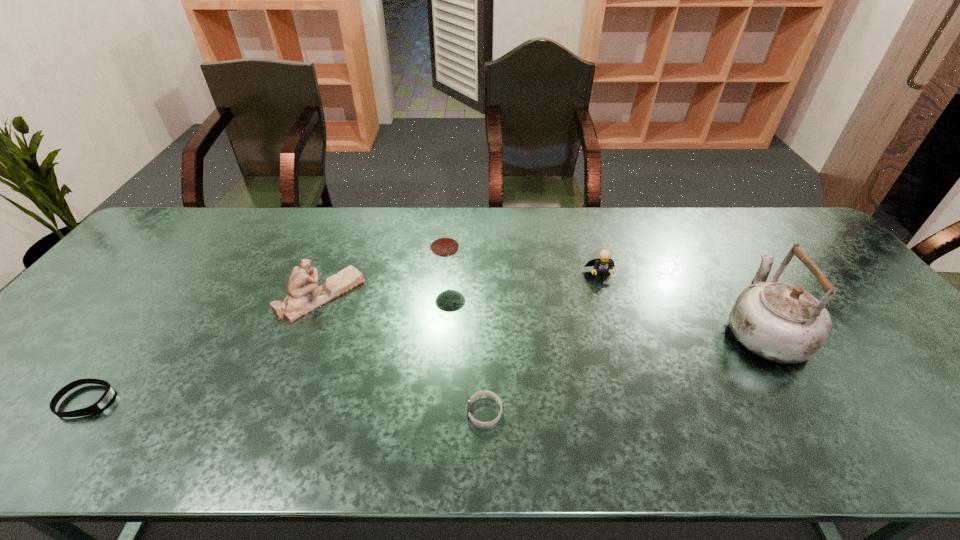
Where is `kettle`? The image size is (960, 540). kettle is located at coordinates (780, 322).

Find the location of a particular element. Image resolution: width=960 pixels, height=540 pixels. the tallest object is located at coordinates (780, 322).

I want to click on wineglass, so click(444, 244).

Find the location of a particular element. the second object from left to right is located at coordinates (305, 295).

Where is `the second object from right to left`? the second object from right to left is located at coordinates (602, 265).

Locate an element on the screen. the fourth tallest object is located at coordinates (602, 265).

The width and height of the screenshot is (960, 540). I want to click on the fourth object from left to right, so click(x=484, y=392).

Where is `the leftmost object`? The image size is (960, 540). the leftmost object is located at coordinates (109, 393).

Find the location of `free region located 0.250m at the spout of the tallest object`. free region located 0.250m at the spout of the tallest object is located at coordinates (708, 241).

Image resolution: width=960 pixels, height=540 pixels. I want to click on vacant space located at the spout of the tallest object, so click(700, 228).